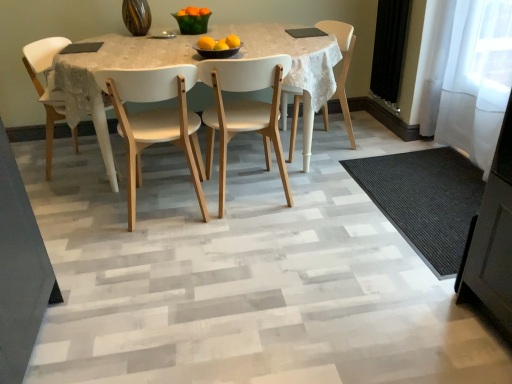
Question: Would you say black textured mat at lower right is part of white wood chair at center, arranged as the fourth chair when viewed from the left,'s contents?

Choices:
 (A) yes
 (B) no

Answer: (B)

Question: Is white wood chair at center, the 1th chair positioned from the right, oriented towards black textured mat at lower right?

Choices:
 (A) no
 (B) yes

Answer: (A)

Question: From a real-world perspective, is white wood chair at center, the 1th chair positioned from the right, physically above black textured mat at lower right?

Choices:
 (A) yes
 (B) no

Answer: (A)

Question: Can you confirm if white wood chair at center, arranged as the fourth chair when viewed from the left, is shorter than black textured mat at lower right?

Choices:
 (A) no
 (B) yes

Answer: (A)

Question: Does white wood chair at center, the 1th chair positioned from the right, have a smaller size compared to black textured mat at lower right?

Choices:
 (A) no
 (B) yes

Answer: (A)

Question: Does point (50, 104) appear closer or farther from the camera than point (347, 64)?

Choices:
 (A) closer
 (B) farther

Answer: (A)

Question: Looking at the image, does white wood chair at left, the first chair in the left-to-right sequence, seem bigger or smaller compared to white wood chair at center, arranged as the fourth chair when viewed from the left?

Choices:
 (A) big
 (B) small

Answer: (B)

Question: Do you think white wood chair at left, the first chair in the left-to-right sequence, is within white wood chair at center, arranged as the fourth chair when viewed from the left, or outside of it?

Choices:
 (A) outside
 (B) inside

Answer: (A)

Question: From the image's perspective, is white wood chair at left, the first chair in the left-to-right sequence, above or below white wood chair at center, the 1th chair positioned from the right?

Choices:
 (A) above
 (B) below

Answer: (B)

Question: In terms of width, does white wood chair at center, arranged as the fourth chair when viewed from the left, look wider or thinner when compared to black textured mat at lower right?

Choices:
 (A) wide
 (B) thin

Answer: (B)

Question: In the image, is white wood chair at center, arranged as the fourth chair when viewed from the left, on the left side or the right side of black textured mat at lower right?

Choices:
 (A) right
 (B) left

Answer: (B)

Question: Is white wood chair at center, arranged as the fourth chair when viewed from the left, taller or shorter than black textured mat at lower right?

Choices:
 (A) tall
 (B) short

Answer: (A)

Question: Looking at the image, does white wood chair at center, arranged as the fourth chair when viewed from the left, seem bigger or smaller compared to black textured mat at lower right?

Choices:
 (A) small
 (B) big

Answer: (B)

Question: Is white wood chair at center, the third chair when ordered from left to right, taller or shorter than white wood chair at left, the first chair in the left-to-right sequence?

Choices:
 (A) short
 (B) tall

Answer: (A)

Question: Considering their positions, is white wood chair at center, which appears as the second chair when viewed from the right, located in front of or behind white wood chair at left, the first chair in the left-to-right sequence?

Choices:
 (A) behind
 (B) front

Answer: (B)